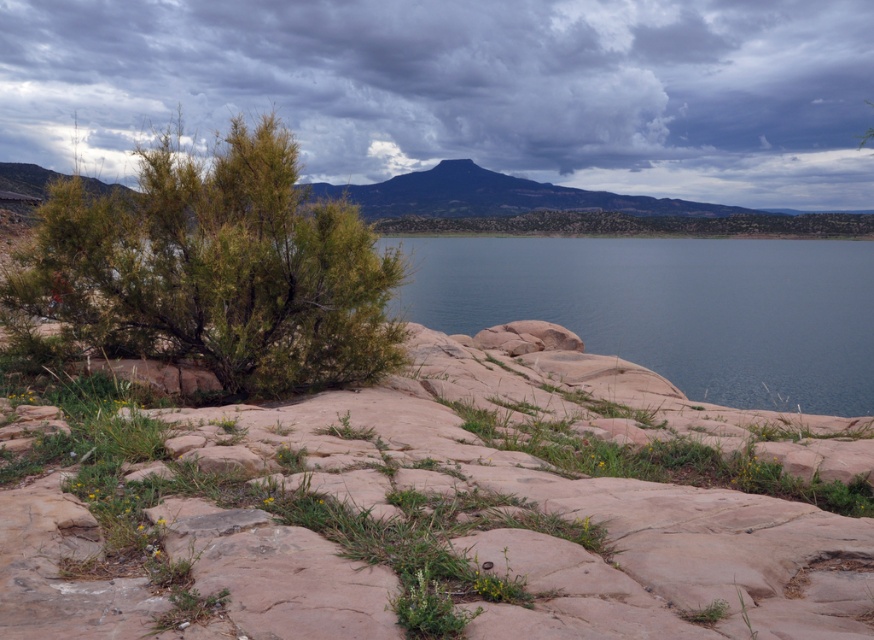
Question: Can you confirm if green leafy bush at left is positioned above blue smooth water at center?

Choices:
 (A) no
 (B) yes

Answer: (A)

Question: Which point appears closest to the camera in this image?

Choices:
 (A) (583, 243)
 (B) (297, 8)
 (C) (96, 280)

Answer: (C)

Question: Based on their relative distances, which object is farther from the blue smooth water at center?

Choices:
 (A) green leafy bush at left
 (B) cloudy sky at upper center

Answer: (A)

Question: Which point is closer to the camera?

Choices:
 (A) cloudy sky at upper center
 (B) green leafy bush at left
 (C) blue smooth water at center

Answer: (B)

Question: Does cloudy sky at upper center have a larger size compared to blue smooth water at center?

Choices:
 (A) no
 (B) yes

Answer: (B)

Question: Is green leafy bush at left positioned at the back of blue smooth water at center?

Choices:
 (A) no
 (B) yes

Answer: (A)